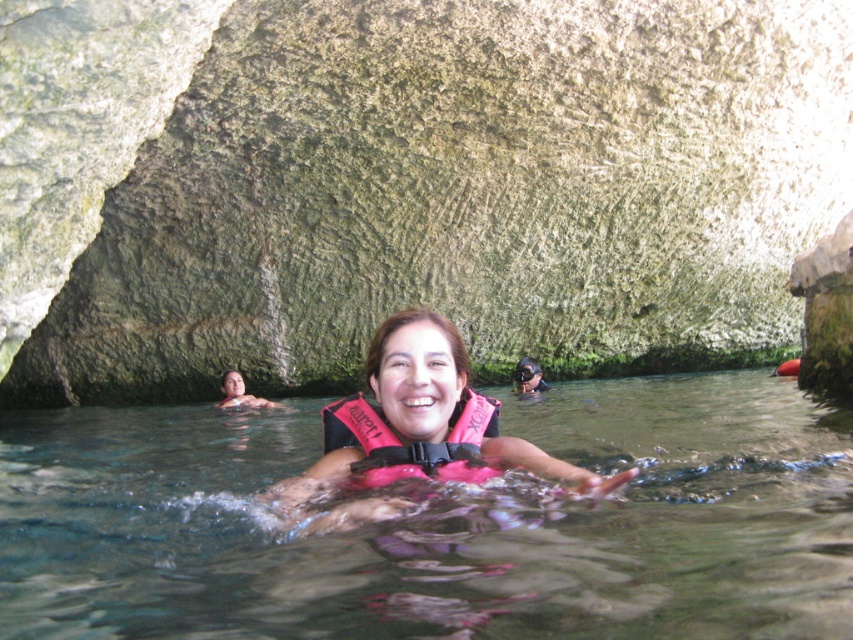
Between clear water at center and smooth skin face at lower left, which one is positioned lower?

Positioned lower is clear water at center.

Where is `clear water at center`? This screenshot has height=640, width=853. clear water at center is located at coordinates (439, 524).

Is point (750, 547) positioned in front of point (227, 385)?

Yes, it is.

This screenshot has height=640, width=853. I want to click on clear water at center, so click(x=439, y=524).

Is clear water at center smaller than pink fabric life jacket at center?

Incorrect, clear water at center is not smaller in size than pink fabric life jacket at center.

Does clear water at center lie in front of pink fabric life jacket at center?

Yes, it is in front of pink fabric life jacket at center.

Find the location of a particular element. clear water at center is located at coordinates (439, 524).

Is point (358, 477) positioned in front of point (531, 378)?

Yes, point (358, 477) is in front of point (531, 378).

Between pink fabric life jacket at center and transparent plastic goggles at center, which one has less height?

transparent plastic goggles at center

Who is more distant from viewer, (x=364, y=468) or (x=531, y=374)?

The point (x=531, y=374) is behind.

The width and height of the screenshot is (853, 640). Identify the location of pink fabric life jacket at center. pyautogui.click(x=415, y=444).